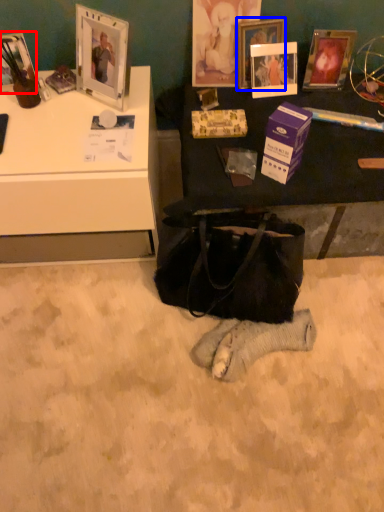
Question: Which of the following is the farthest to the observer, picture frame (highlighted by a red box) or picture frame (highlighted by a blue box)?

Choices:
 (A) picture frame
 (B) picture frame

Answer: (B)